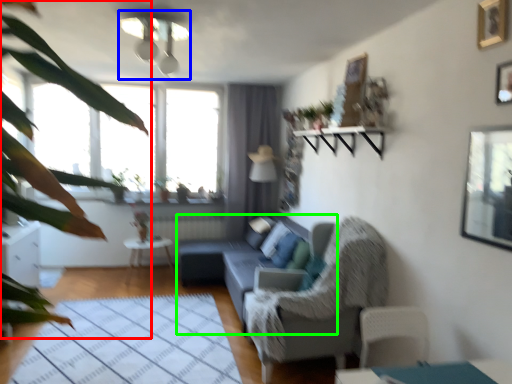
Question: Based on their relative distances, which object is farther from vegetation (highlighted by a red box)? Choose from light fixture (highlighted by a blue box) and studio couch (highlighted by a green box).

Choices:
 (A) light fixture
 (B) studio couch

Answer: (B)